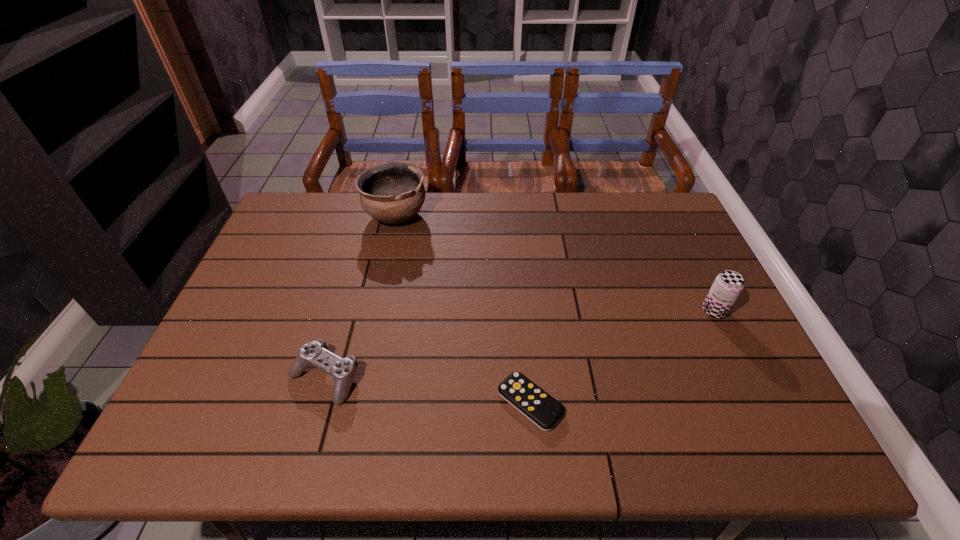
In order to click on blank space that satisfies the following two spatial constraints: 1. on the front side of the pottery; 2. on the left side of the beer can in this screenshot , I will do `click(374, 311)`.

Where is `vacant space that satisfies the following two spatial constraints: 1. on the front side of the control; 2. on the right side of the remote control`? The image size is (960, 540). vacant space that satisfies the following two spatial constraints: 1. on the front side of the control; 2. on the right side of the remote control is located at coordinates (317, 403).